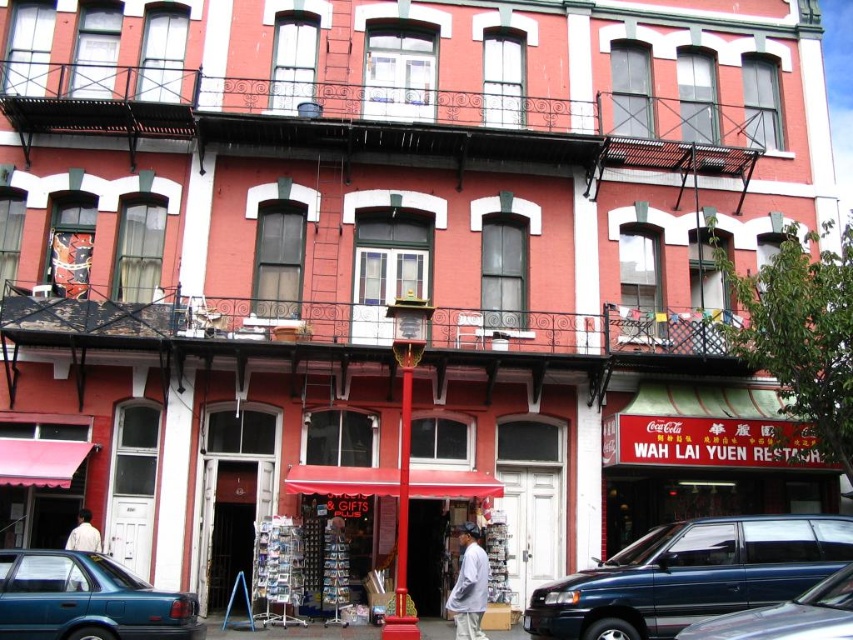
Can you confirm if metallic blue minivan at lower right is wider than metallic blue van at lower right?

Indeed, metallic blue minivan at lower right has a greater width compared to metallic blue van at lower right.

Where is `metallic blue minivan at lower right`? metallic blue minivan at lower right is located at coordinates coord(689,576).

Who is more distant from viewer, (735,596) or (779,620)?

Positioned behind is point (735,596).

Find the location of `metallic blue minivan at lower right`. metallic blue minivan at lower right is located at coordinates (689, 576).

Does teal glossy sedan at lower left come in front of white cotton shirt at lower left?

Yes.

Measure the distance from teal glossy sedan at lower left to white cotton shirt at lower left.

A distance of 11.32 meters exists between teal glossy sedan at lower left and white cotton shirt at lower left.

Describe the element at coordinates (86, 600) in the screenshot. The height and width of the screenshot is (640, 853). I see `teal glossy sedan at lower left` at that location.

Image resolution: width=853 pixels, height=640 pixels. Identify the location of teal glossy sedan at lower left. (86, 600).

In order to click on metallic blue minivan at lower right in this screenshot , I will do `click(689, 576)`.

Which of these two, metallic blue minivan at lower right or teal glossy sedan at lower left, stands taller?

metallic blue minivan at lower right

This screenshot has width=853, height=640. Describe the element at coordinates (689, 576) in the screenshot. I see `metallic blue minivan at lower right` at that location.

Where is `metallic blue minivan at lower right`? The height and width of the screenshot is (640, 853). metallic blue minivan at lower right is located at coordinates (689, 576).